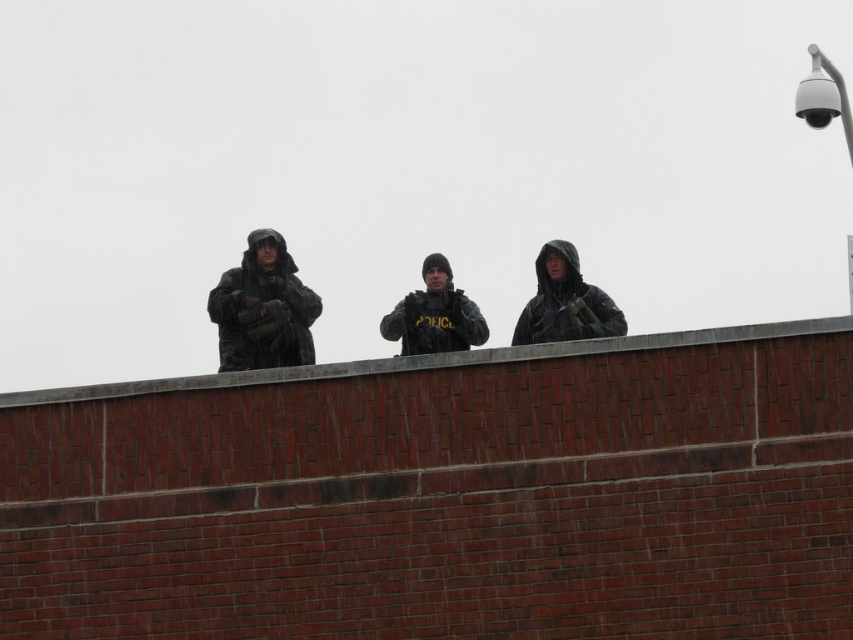
Which is behind, point (546, 333) or point (409, 326)?

Point (409, 326)

Can you confirm if matte black jacket at center is wider than camouflage uniform at center?

Yes.

At what (x,y) coordinates should I click in order to perform the action: click on matte black jacket at center. Please return your answer as a coordinate pair (x, y). This screenshot has width=853, height=640. Looking at the image, I should click on (566, 301).

Between point (271, 253) and point (552, 301), which one is positioned in front?

Point (552, 301)

Is camouflage fabric uniform at center closer to camera compared to matte black jacket at center?

No, it is not.

The image size is (853, 640). Identify the location of camouflage fabric uniform at center. pyautogui.click(x=263, y=308).

Which of these two, camouflage fabric uniform at center or camouflage uniform at center, stands shorter?

With less height is camouflage uniform at center.

In the scene shown: Who is lower down, camouflage fabric uniform at center or camouflage uniform at center?

camouflage fabric uniform at center

Which is behind, point (300, 298) or point (421, 305)?

Positioned behind is point (421, 305).

You are a GUI agent. You are given a task and a screenshot of the screen. Output one action in this format:
    pyautogui.click(x=<x>, y=<y>)
    Task: Click on the camouflage fabric uniform at center
    The width and height of the screenshot is (853, 640).
    Given the screenshot: What is the action you would take?
    pyautogui.click(x=263, y=308)